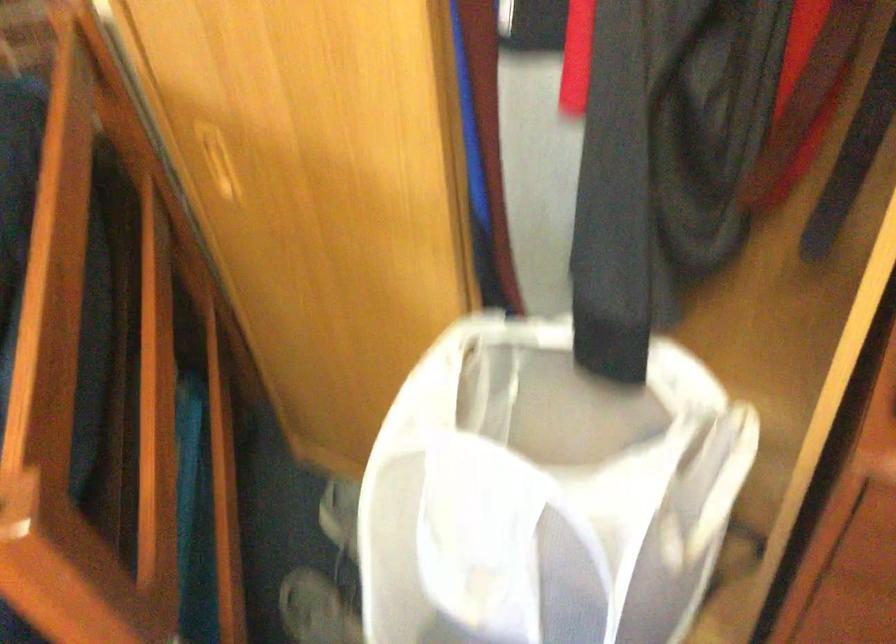
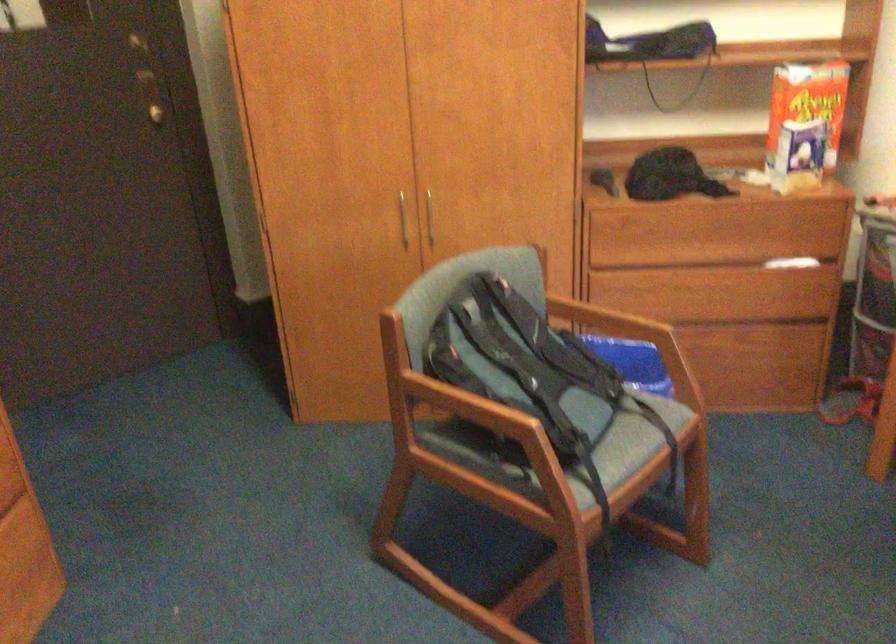
Based on the photo, based on the continuous images, in which direction is the camera rotating?

The rotation direction of the camera is right-down.